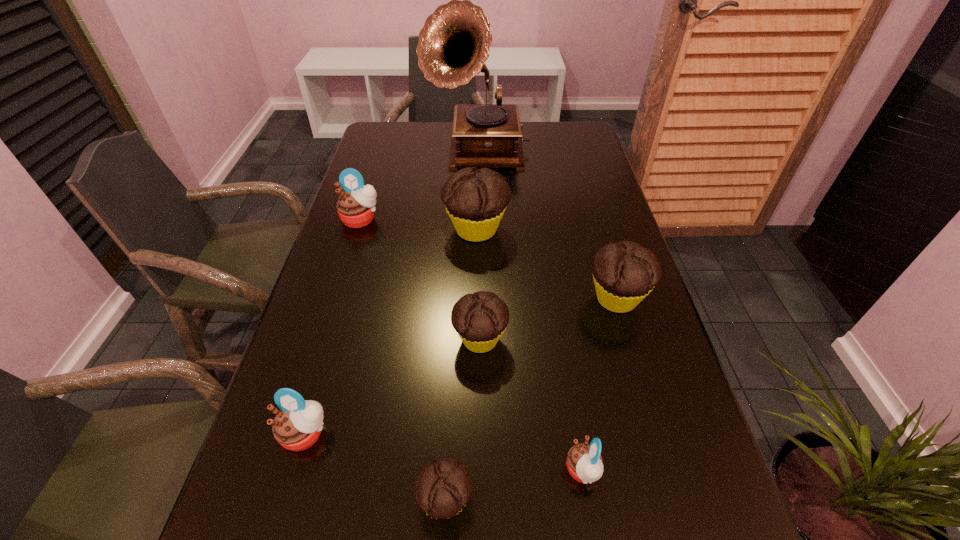
Find the location of a particular element. the farthest object is located at coordinates (454, 43).

Locate an element on the screen. The height and width of the screenshot is (540, 960). brown record player is located at coordinates (454, 43).

The height and width of the screenshot is (540, 960). Identify the location of the farthest chocolate muffin. (475, 199).

I want to click on the farthest pink muffin, so click(355, 207).

This screenshot has height=540, width=960. I want to click on the rightmost chocolate muffin, so click(x=624, y=273).

Locate an element on the screen. The height and width of the screenshot is (540, 960). the rightmost object is located at coordinates (624, 273).

At what (x,y) coordinates should I click in order to perform the action: click on the second biggest pink muffin. Please return your answer as a coordinate pair (x, y). Looking at the image, I should click on (297, 426).

Identify the location of the second smallest chocolate muffin. This screenshot has height=540, width=960. (480, 319).

Where is `the smallest pink muffin`? The height and width of the screenshot is (540, 960). the smallest pink muffin is located at coordinates (584, 462).

Locate an element on the screen. the rightmost pink muffin is located at coordinates (584, 462).